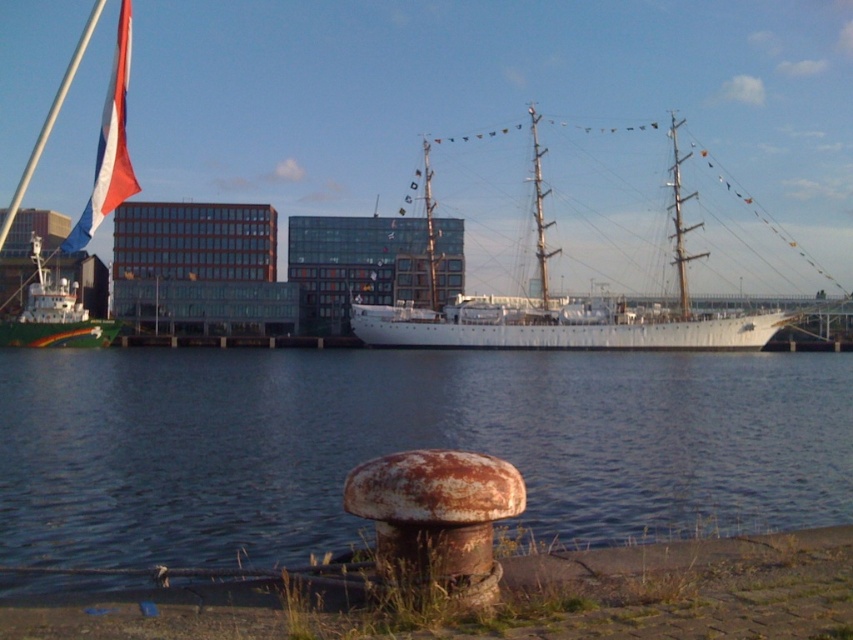
Question: Which point is closer to the camera?

Choices:
 (A) (422, 320)
 (B) (97, 204)

Answer: (B)

Question: Is white polished wood ship at center below red-white-blue fabric flag at upper left?

Choices:
 (A) yes
 (B) no

Answer: (A)

Question: Based on their relative distances, which object is nearer to the white glossy ship at left?

Choices:
 (A) red-white-blue fabric flag at upper left
 (B) white polished wood ship at center

Answer: (A)

Question: Does white polished wood ship at center lie behind white glossy ship at left?

Choices:
 (A) no
 (B) yes

Answer: (A)

Question: Does white polished wood ship at center appear over red-white-blue fabric flag at upper left?

Choices:
 (A) no
 (B) yes

Answer: (A)

Question: Which point is closer to the camera taking this photo?

Choices:
 (A) (86, 220)
 (B) (44, 333)
 (C) (540, 186)

Answer: (A)